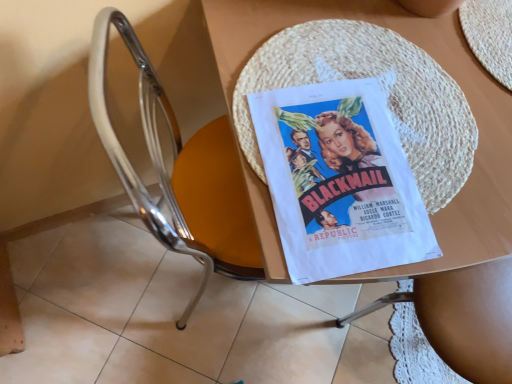
Question: Considering the relative sizes of wooden table at center and white paper poster at center in the image provided, is wooden table at center smaller than white paper poster at center?

Choices:
 (A) yes
 (B) no

Answer: (B)

Question: From a real-world perspective, is wooden table at center under white paper poster at center?

Choices:
 (A) yes
 (B) no

Answer: (A)

Question: From the image's perspective, does wooden table at center appear higher than white paper poster at center?

Choices:
 (A) no
 (B) yes

Answer: (B)

Question: From a real-world perspective, is wooden table at center on top of white paper poster at center?

Choices:
 (A) yes
 (B) no

Answer: (B)

Question: Would you say wooden table at center is a long distance from white paper poster at center?

Choices:
 (A) no
 (B) yes

Answer: (A)

Question: From the image's perspective, is metallic chrome chair at center above or below wooden table at center?

Choices:
 (A) below
 (B) above

Answer: (A)

Question: Considering the positions of point (205, 215) and point (450, 288), is point (205, 215) closer or farther from the camera than point (450, 288)?

Choices:
 (A) closer
 (B) farther

Answer: (A)

Question: In terms of size, does metallic chrome chair at center appear bigger or smaller than wooden table at center?

Choices:
 (A) small
 (B) big

Answer: (A)

Question: Would you say metallic chrome chair at center is to the left or to the right of wooden table at center in the picture?

Choices:
 (A) right
 (B) left

Answer: (B)

Question: Is white paper poster at center bigger or smaller than wooden table at center?

Choices:
 (A) big
 (B) small

Answer: (B)

Question: From the image's perspective, is white paper poster at center located above or below wooden table at center?

Choices:
 (A) above
 (B) below

Answer: (B)

Question: Is white paper poster at center inside the boundaries of wooden table at center, or outside?

Choices:
 (A) outside
 (B) inside

Answer: (B)

Question: Is white paper poster at center wider or thinner than wooden table at center?

Choices:
 (A) thin
 (B) wide

Answer: (A)

Question: Considering the positions of white paper poster at center and metallic chrome chair at center in the image, is white paper poster at center wider or thinner than metallic chrome chair at center?

Choices:
 (A) wide
 (B) thin

Answer: (B)

Question: Relative to metallic chrome chair at center, is white paper poster at center in front or behind?

Choices:
 (A) behind
 (B) front

Answer: (A)